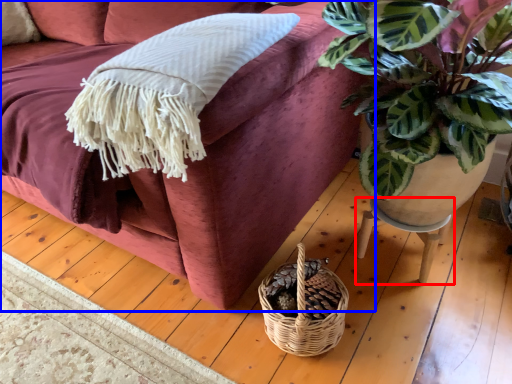
Question: Which object appears farthest to the camera in this image, table (highlighted by a red box) or studio couch (highlighted by a blue box)?

Choices:
 (A) table
 (B) studio couch

Answer: (A)